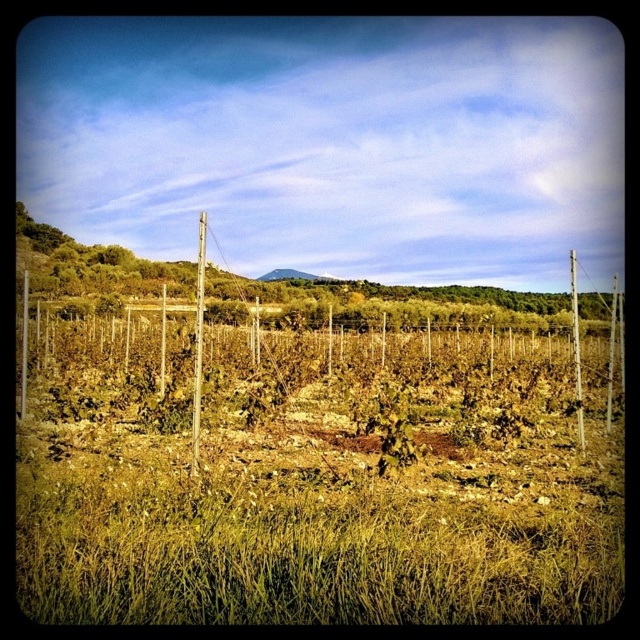
Who is positioned more to the right, green grassy field at center or smooth wooden pole at right?

Positioned to the right is smooth wooden pole at right.

Is green grassy field at center shorter than smooth wooden pole at right?

Yes.

Who is more forward, (x=88, y=380) or (x=570, y=266)?

Point (x=88, y=380) is in front.

Where is `green grassy field at center`? This screenshot has height=640, width=640. green grassy field at center is located at coordinates (317, 492).

Who is positioned more to the right, green grassy field at center or green leafy weed at center?

Positioned to the right is green leafy weed at center.

Which is behind, point (141, 499) or point (360, 412)?

Positioned behind is point (360, 412).

Find the location of a particular element. Image resolution: width=640 pixels, height=640 pixels. green grassy field at center is located at coordinates (317, 492).

Between point (400, 440) and point (573, 308), which one is positioned behind?

The point (573, 308) is behind.

Where is `green leafy weed at center`? green leafy weed at center is located at coordinates 388,424.

Describe the element at coordinates (388, 424) in the screenshot. I see `green leafy weed at center` at that location.

I want to click on green leafy weed at center, so click(x=388, y=424).